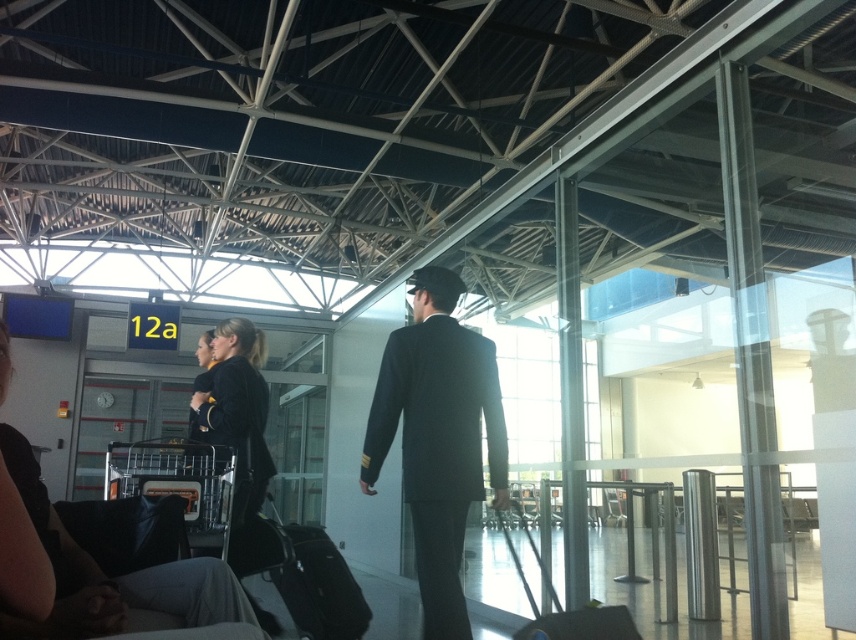
From the picture: You are a traveler at the airport terminal. You see two suitcases at center, a matte black suitcase at center and a black fabric suitcase at center. Which one is positioned to the left?

The matte black suitcase at center is to the left of the black fabric suitcase at center.

You are a cleaning robot with a width of 1 meter. You are positioned near the black leather jacket at upper left and want to move towards the dark blue suit at center. Can you navigate the space between them without hitting any obstacles?

The distance between the dark blue suit at center and the black leather jacket at upper left is 1.21 meters. Since the robot is 1 meter wide, there is enough space to navigate between them without any obstacles.

You are a traveler at the airport terminal and you have two suitcases, the matte black suitcase at center and the black fabric suitcase at center. You need to place them on the luggage cart which can only hold items within a 3 feet radius. Can both suitcases fit on the cart?

The distance between the matte black suitcase at center and the black fabric suitcase at center is 3.89 feet, which exceeds the 3 feet radius of the luggage cart. Therefore, both suitcases cannot fit on the cart simultaneously.